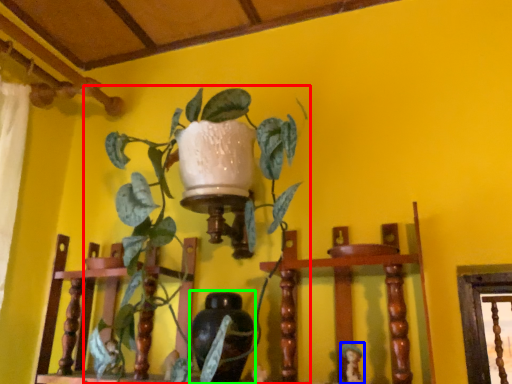
Question: Which is nearer to the houseplant (highlighted by a red box)? toy (highlighted by a blue box) or vase (highlighted by a green box).

Choices:
 (A) toy
 (B) vase

Answer: (B)